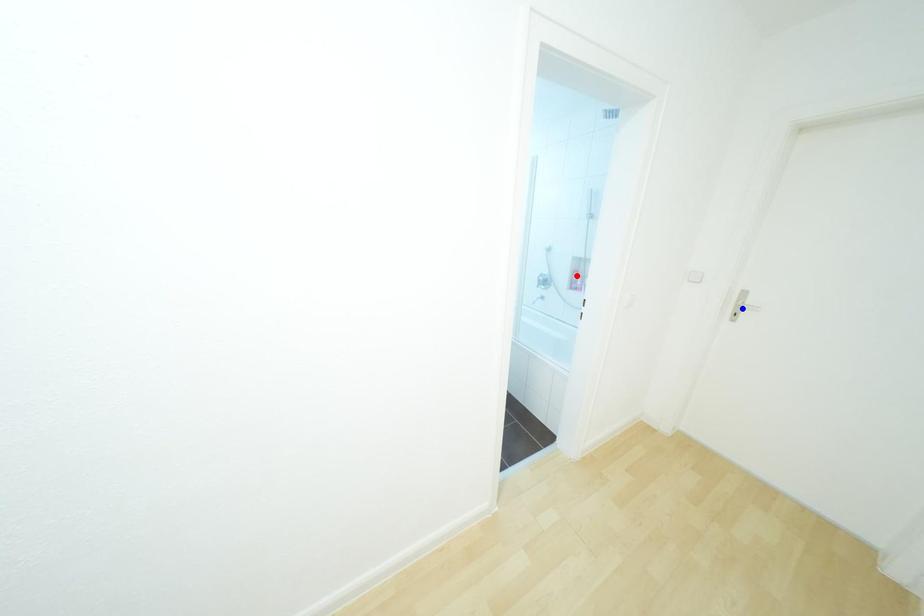
Question: Which of the two points in the image is closer to the camera?

Choices:
 (A) Blue point is closer.
 (B) Red point is closer.

Answer: (A)